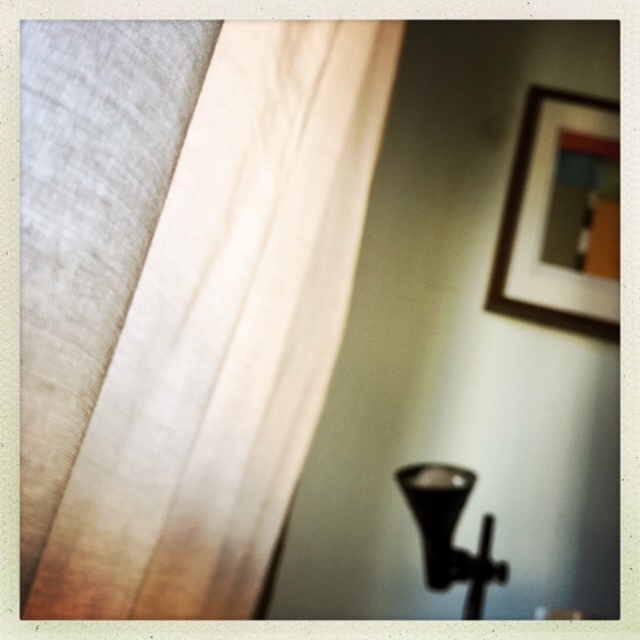
Question: Which of the following is the farthest from the observer?

Choices:
 (A) (600, 296)
 (B) (588, 224)
 (C) (444, 576)
 (D) (161, 330)

Answer: (B)

Question: Considering the real-world distances, which object is closest to the matte glass window at upper right?

Choices:
 (A) black matte lamp at lower right
 (B) matte white curtain at upper left

Answer: (A)

Question: Among these points, which one is farthest from the camera?

Choices:
 (A) tap(292, 300)
 (B) tap(426, 484)
 (C) tap(547, 141)
 (D) tap(602, 268)

Answer: (C)

Question: Can you confirm if matte white curtain at upper left is bigger than black matte lamp at lower right?

Choices:
 (A) yes
 (B) no

Answer: (A)

Question: Can you confirm if matte white curtain at upper left is smaller than matte glass window at upper right?

Choices:
 (A) no
 (B) yes

Answer: (A)

Question: Is matte white curtain at upper left to the left of matte glass window at upper right from the viewer's perspective?

Choices:
 (A) no
 (B) yes

Answer: (B)